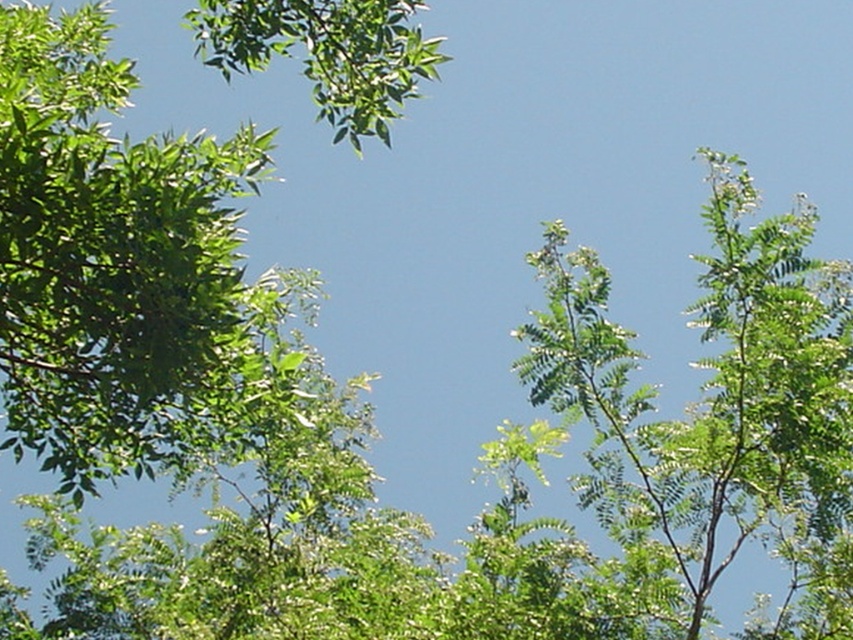
At what (x,y) coordinates should I click in order to perform the action: click on green leafy tree at upper left. Please return your answer as a coordinate pair (x, y). Looking at the image, I should click on (119, 269).

How distant is green leafy tree at upper left from green leafy tree at upper right?

green leafy tree at upper left and green leafy tree at upper right are 4.74 feet apart from each other.

The image size is (853, 640). I want to click on green leafy tree at upper left, so pyautogui.click(x=119, y=269).

Does point (350, 10) lie in front of point (347, 61)?

No, (350, 10) is further to viewer.

Based on the photo, is green leafy tree at upper left further to camera compared to green leafy branch at upper left?

No, it is in front of green leafy branch at upper left.

You are a GUI agent. You are given a task and a screenshot of the screen. Output one action in this format:
    pyautogui.click(x=<x>, y=<y>)
    Task: Click on the green leafy tree at upper left
    This screenshot has height=640, width=853.
    Given the screenshot: What is the action you would take?
    pyautogui.click(x=119, y=269)

Find the location of a particular element. Image resolution: width=853 pixels, height=640 pixels. green leafy tree at upper left is located at coordinates (119, 269).

Who is more forward, (618,470) or (289,49)?

Point (618,470) is more forward.

Between green leafy tree at upper right and green leafy branch at upper left, which one appears on the left side from the viewer's perspective?

green leafy branch at upper left

Where is `green leafy tree at upper right`? green leafy tree at upper right is located at coordinates (712, 392).